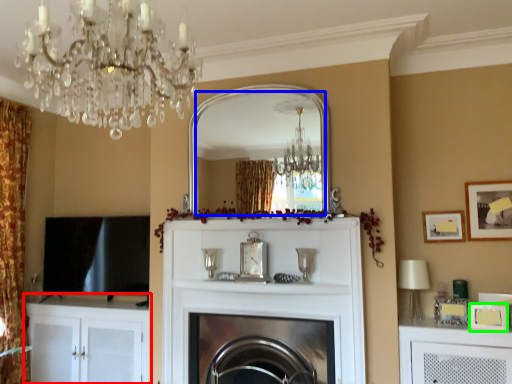
Question: Which object is the closest to the cabinetry (highlighted by a red box)? Choose among these: mirror (highlighted by a blue box) or picture frame (highlighted by a green box).

Choices:
 (A) mirror
 (B) picture frame

Answer: (A)